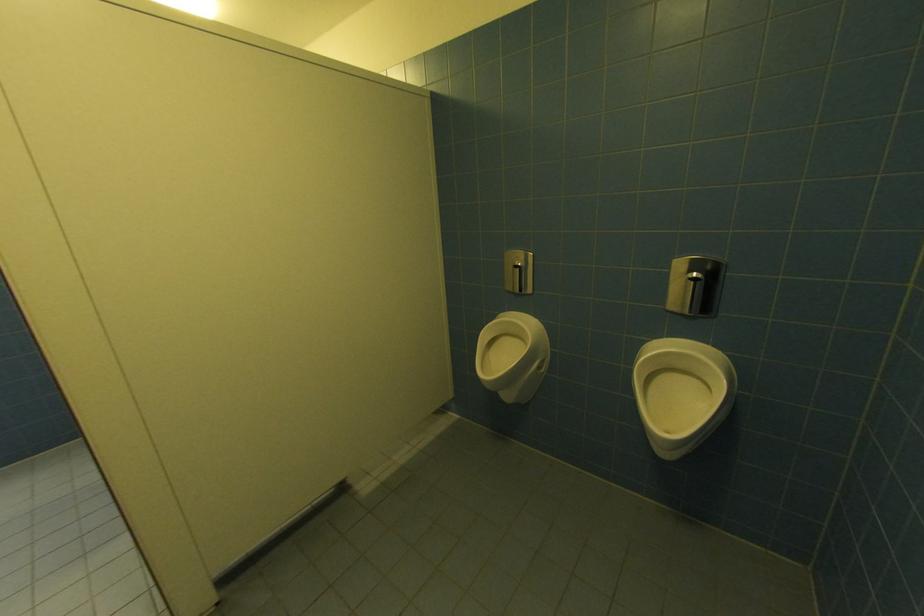
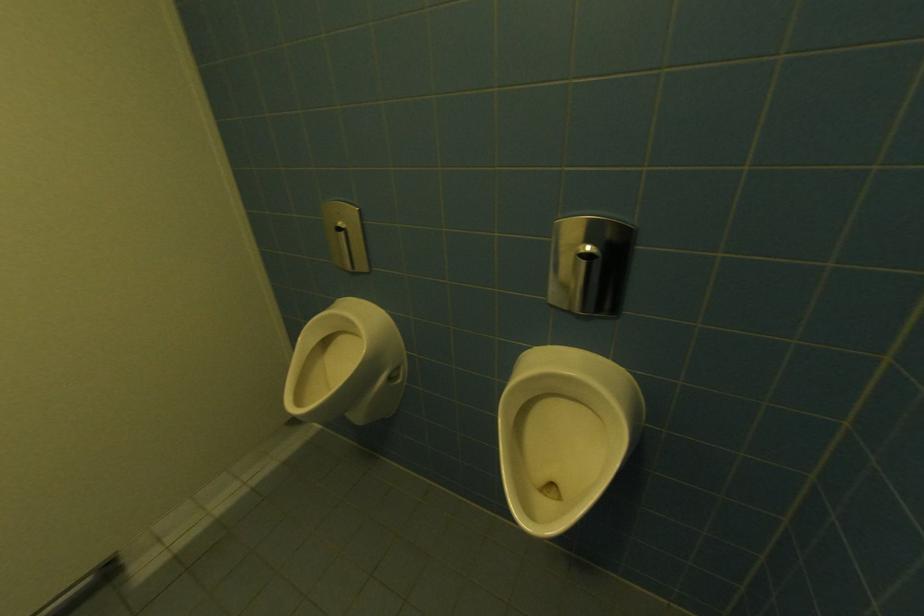
Question: The first image is from the beginning of the video and the second image is from the end. How did the camera likely rotate when shooting the video?

Choices:
 (A) Left
 (B) Right
 (C) Up
 (D) Down

Answer: (B)